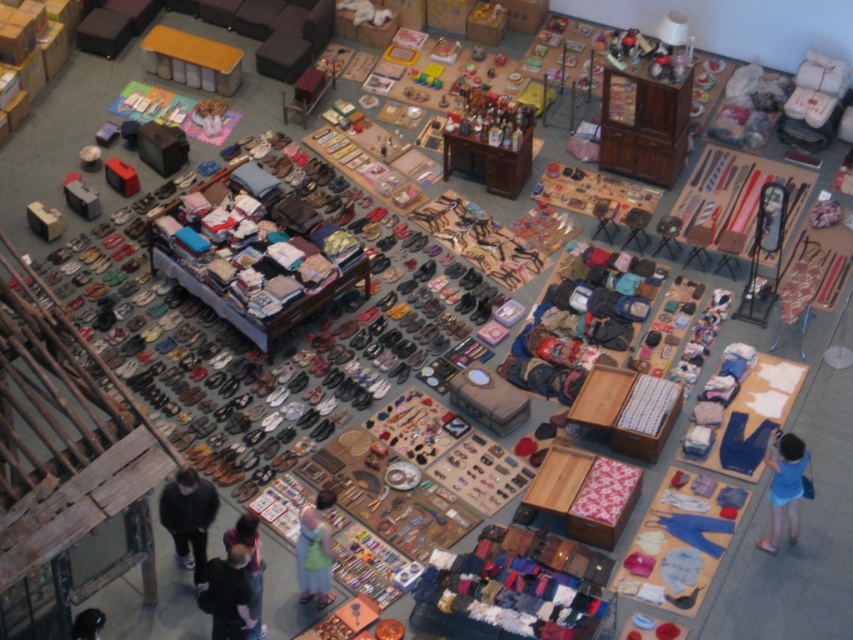
Does dark blue fabric at lower center have a lesser height compared to blue fabric dress at lower right?

Correct, dark blue fabric at lower center is not as tall as blue fabric dress at lower right.

Between dark blue fabric at lower center and blue fabric dress at lower right, which one has more height?

With more height is blue fabric dress at lower right.

Between point (219, 563) and point (791, 536), which one is positioned in front?

Positioned in front is point (219, 563).

I want to click on dark blue fabric at lower center, so click(227, 595).

Can you confirm if dark gray sweater at lower left is shorter than blue fabric dress at lower right?

Incorrect, dark gray sweater at lower left's height does not fall short of blue fabric dress at lower right's.

Who is higher up, dark gray sweater at lower left or blue fabric dress at lower right?

blue fabric dress at lower right is higher up.

You are a GUI agent. You are given a task and a screenshot of the screen. Output one action in this format:
    pyautogui.click(x=<x>, y=<y>)
    Task: Click on the dark gray sweater at lower left
    The image size is (853, 640).
    Given the screenshot: What is the action you would take?
    pyautogui.click(x=189, y=518)

Can you confirm if light blue fabric dress at center is wider than dark blue jeans at lower center?

Indeed, light blue fabric dress at center has a greater width compared to dark blue jeans at lower center.

What do you see at coordinates (315, 550) in the screenshot? I see `light blue fabric dress at center` at bounding box center [315, 550].

Describe the element at coordinates (315, 550) in the screenshot. I see `light blue fabric dress at center` at that location.

Find the location of `light blue fabric dress at center`. light blue fabric dress at center is located at coordinates (315, 550).